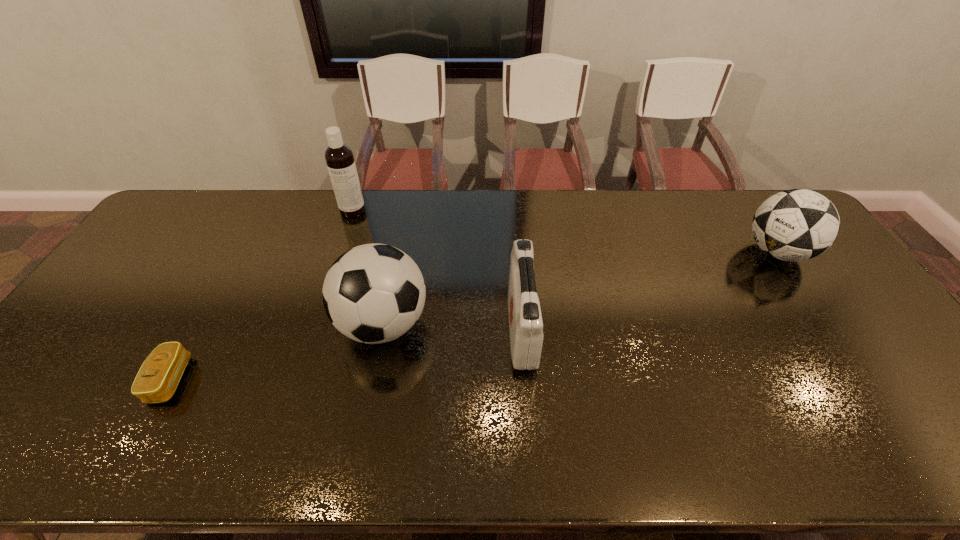
Identify the location of object at the right edge. point(793,225).

The width and height of the screenshot is (960, 540). Identify the location of object positioned at the far right corner. (793, 225).

I want to click on vacant space at the far edge of the desktop, so click(x=561, y=204).

Where is `free location at the near edge of the desktop`? free location at the near edge of the desktop is located at coordinates (432, 455).

In order to click on free space at the left edge in this screenshot , I will do `click(136, 316)`.

Find the location of a particular element. free space at the right edge is located at coordinates (852, 292).

Locate an element on the screen. The width and height of the screenshot is (960, 540). vacant region at the far left corner of the desktop is located at coordinates (196, 198).

In the image, there is a desktop. Where is `vacant space at the near left corner`? The height and width of the screenshot is (540, 960). vacant space at the near left corner is located at coordinates (1, 462).

The width and height of the screenshot is (960, 540). I want to click on free area in between the shortest object and the first-aid kit, so click(347, 354).

This screenshot has width=960, height=540. Identify the location of vacant space that's between the rightmost object and the shortest object. (474, 316).